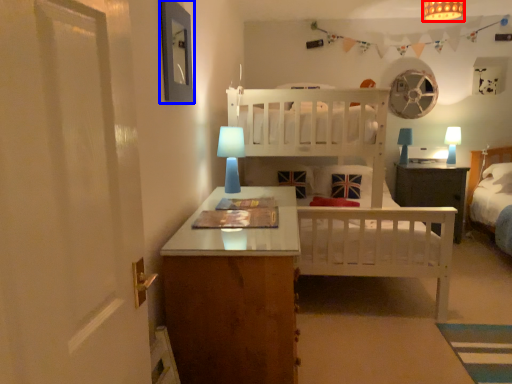
Question: Which object appears farthest to the camera in this image, light fixture (highlighted by a red box) or picture frame (highlighted by a blue box)?

Choices:
 (A) light fixture
 (B) picture frame

Answer: (A)